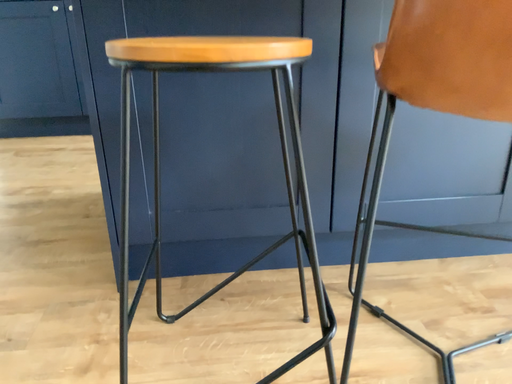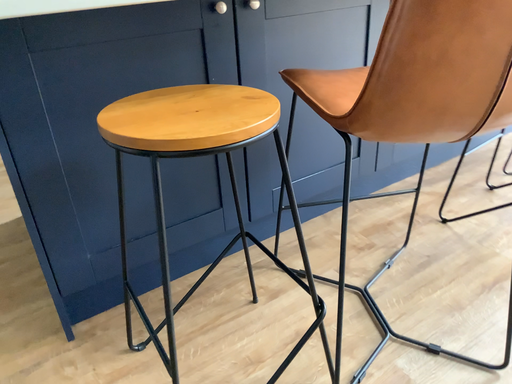
Question: How did the camera likely rotate when shooting the video?

Choices:
 (A) rotated right
 (B) rotated left

Answer: (A)